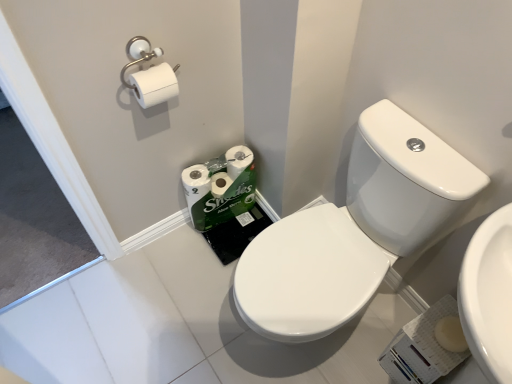
The width and height of the screenshot is (512, 384). I want to click on blank space to the left of white glossy sink at center right, so [185, 305].